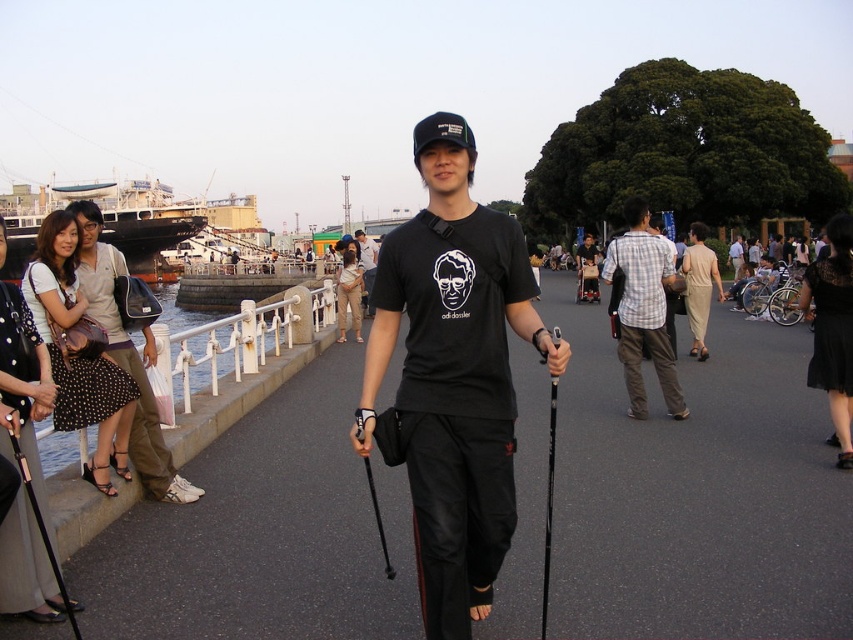
From the picture: You are a photographer setting up a shot of the man in the scene. You need to ensure that the plaid cotton shirt at center and the black rubber ski pole at center are both visible in the frame. Which object will appear larger in the photo?

The plaid cotton shirt at center is taller than the black rubber ski pole at center, so it will appear larger in the photo.